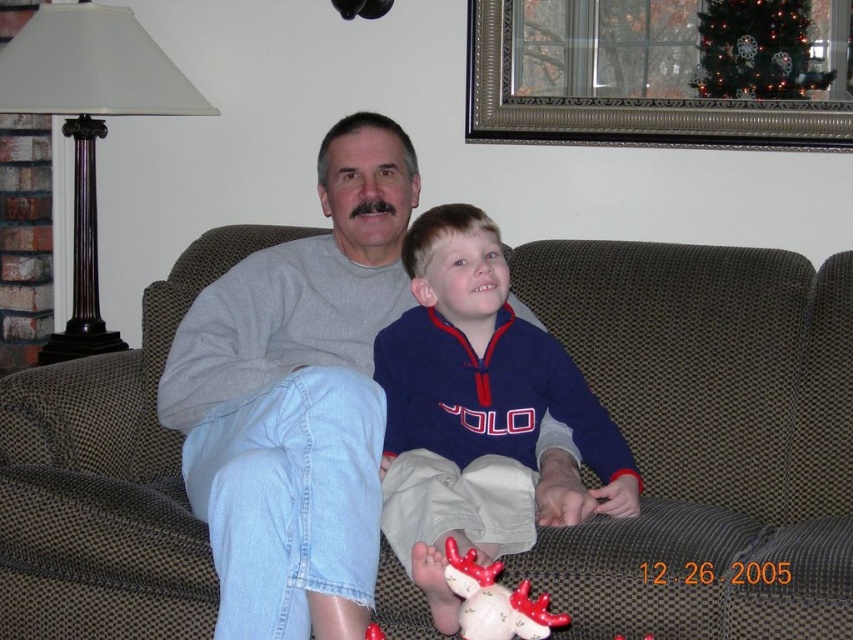
You are a delivery person trying to place a rectangular package that is 1.2 meters long between the brown fabric couch at center and the matte red plush reindeer at lower center. Based on the scene description, can the package fit horizontally between these two objects?

The brown fabric couch at center is wider than the matte red plush reindeer at lower center. However, the exact distance between them isn

You are trying to find the blue fleece jacket at center. According to the scene, where is it located relative to the brown fabric couch at center?

The blue fleece jacket at center is to the left of the brown fabric couch at center because the brown fabric couch at center is to the right of the blue fleece jacket at center.

You are planning to place a new coffee table in the living room. The coffee table will be placed at point 0.686, 0.829. Is this the same location as the brown fabric couch at center?

Yes, the brown fabric couch at center is located at point (706, 438), so placing the coffee table at that coordinate would be the same location as the brown fabric couch at center.